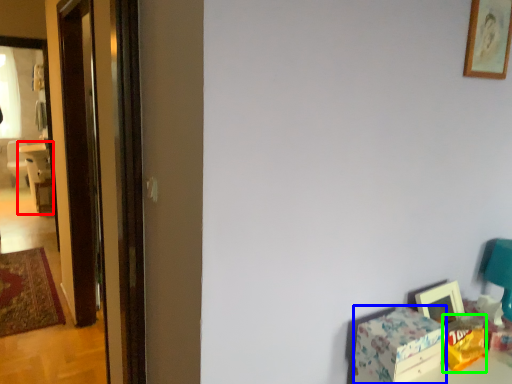
Question: Which object is positioned closest to chair (highlighted by a red box)? Select from box (highlighted by a blue box) and box (highlighted by a green box).

Choices:
 (A) box
 (B) box

Answer: (A)